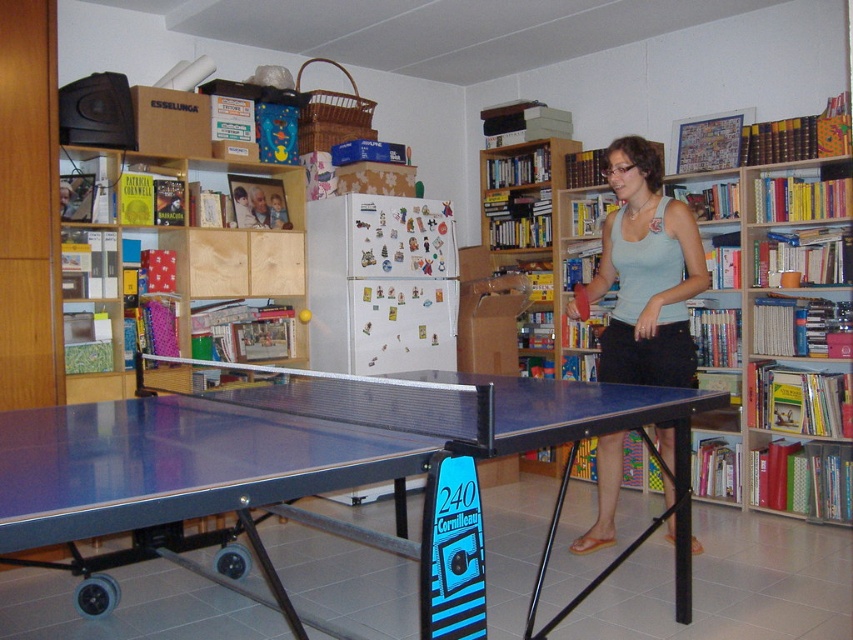
From the picture: You are organizing a ping pong tournament and need to set up the blue glossy ping pong table at center. However, there is a light blue tank top at center in the way. Based on their positions, can you place the table without moving the tank top?

The blue glossy ping pong table at center is located below the light blue tank top at center, so you can place the table without moving the tank top since it is positioned under it.

You are setting up a home gym and need to place a 1.8m tall exercise equipment next to the blue glossy ping pong table at center and the blue plastic table tennis table at center. Which table should you place it next to if you want to ensure there is enough vertical space?

The blue glossy ping pong table at center is taller than the blue plastic table tennis table at center. Therefore, you should place the 1.8m tall exercise equipment next to the blue plastic table tennis table at center to ensure there is enough vertical space.